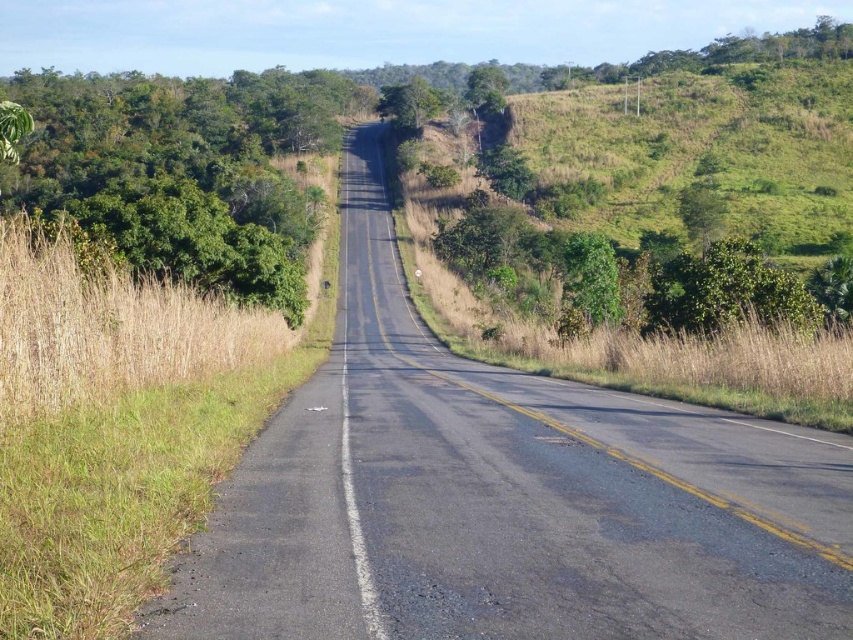
Based on the photo, you are driving along the road and see two green leafy trees ahead. The first is the green leafy tree at left, and the second is the green leafy tree at center. Which tree would you pass first while driving on the right lane?

The green leafy tree at left would be passed first because it is positioned to the left of the green leafy tree at center, meaning it is closer to your current position when driving on the right lane.